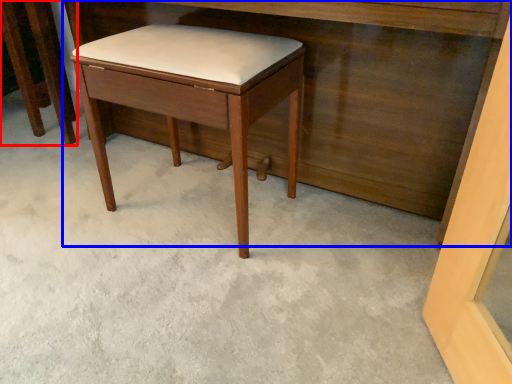
Question: Which point is further to the camera, furniture (highlighted by a red box) or vanity (highlighted by a blue box)?

Choices:
 (A) furniture
 (B) vanity

Answer: (A)